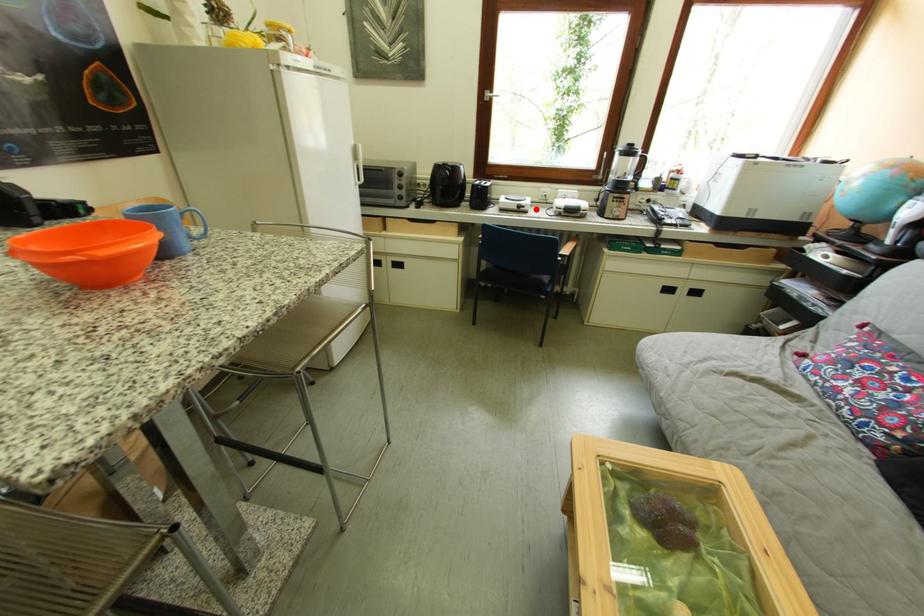
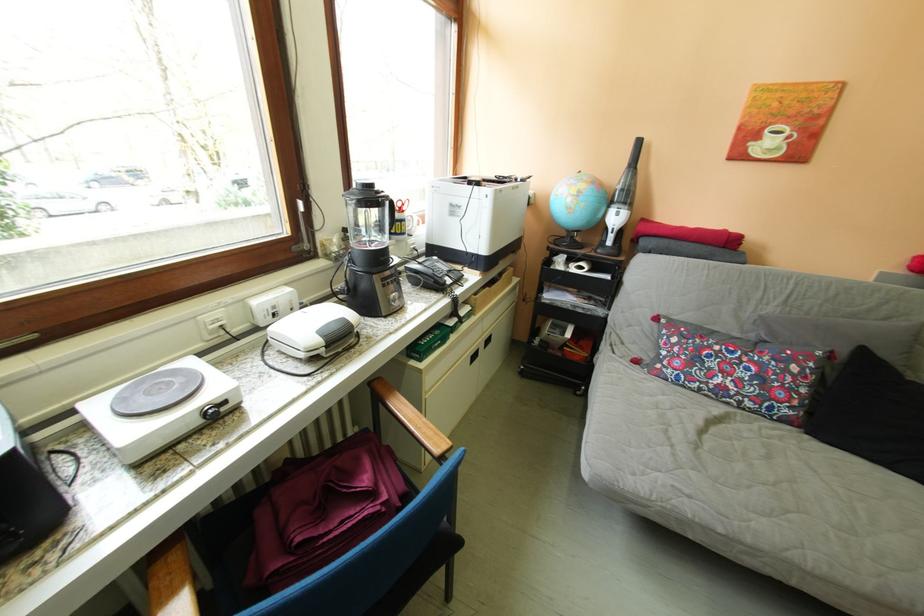
Question: I am providing you with two images of the same scene from different viewpoints. Image1 has a red point marked. In image2, the corresponding 3D location appears at what relative position? Reply with the corresponding letter.

Choices:
 (A) Closer
 (B) Farther

Answer: (B)